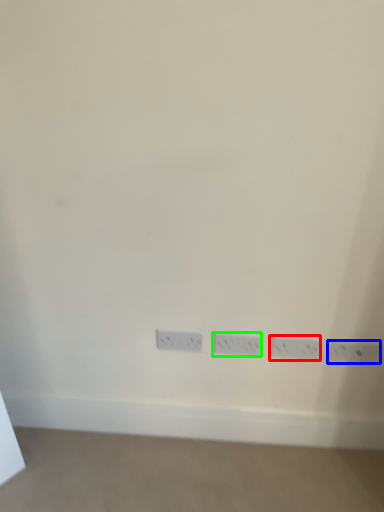
Question: Which is farther away from power plugs and sockets (highlighted by a red box)? power plugs and sockets (highlighted by a blue box) or power plugs and sockets (highlighted by a green box)?

Choices:
 (A) power plugs and sockets
 (B) power plugs and sockets

Answer: (B)